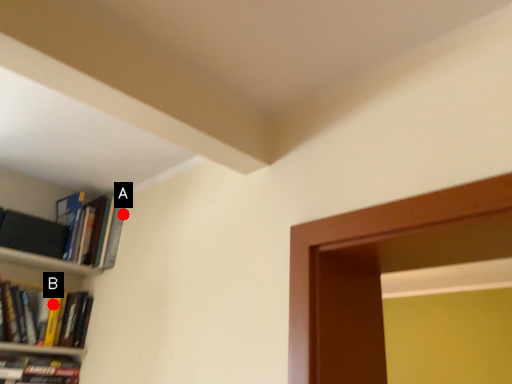
Question: Two points are circled on the image, labeled by A and B beside each circle. Which point is further to the camera?

Choices:
 (A) A is further
 (B) B is further

Answer: (A)